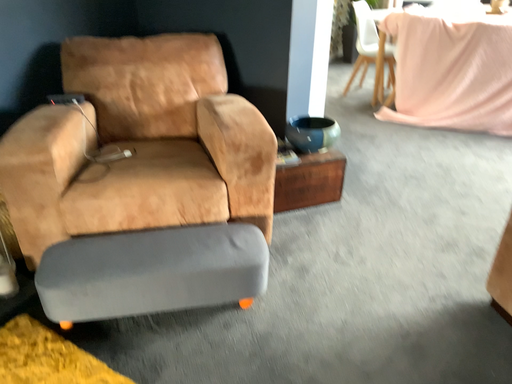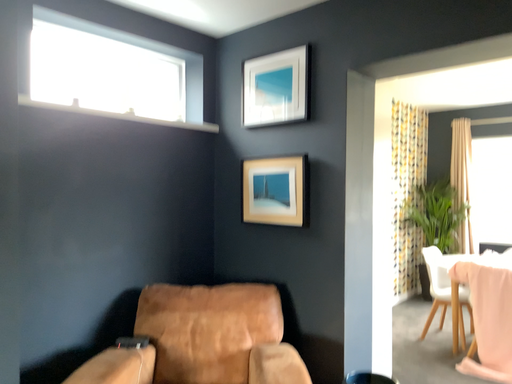
Question: Which way did the camera rotate in the video?

Choices:
 (A) rotated downward
 (B) rotated upward

Answer: (B)